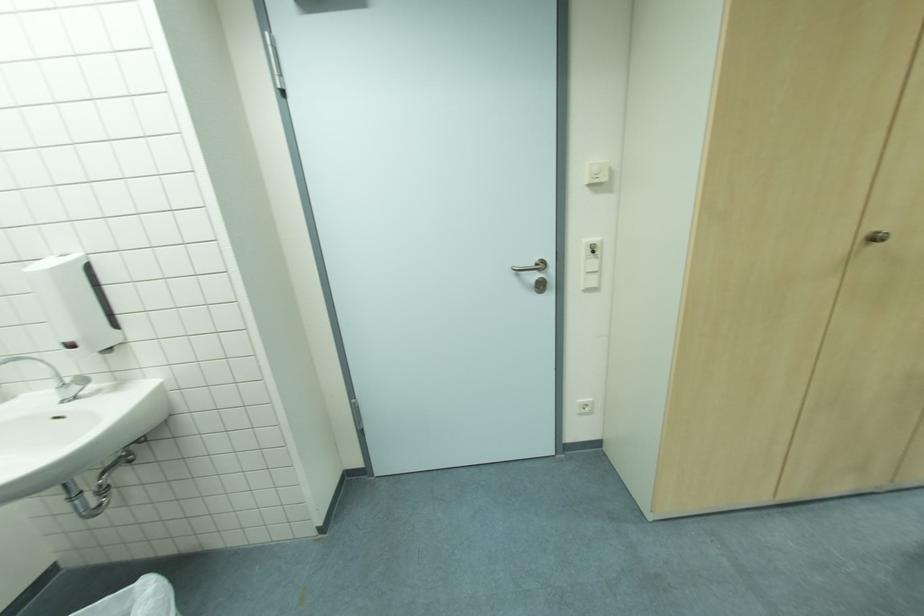
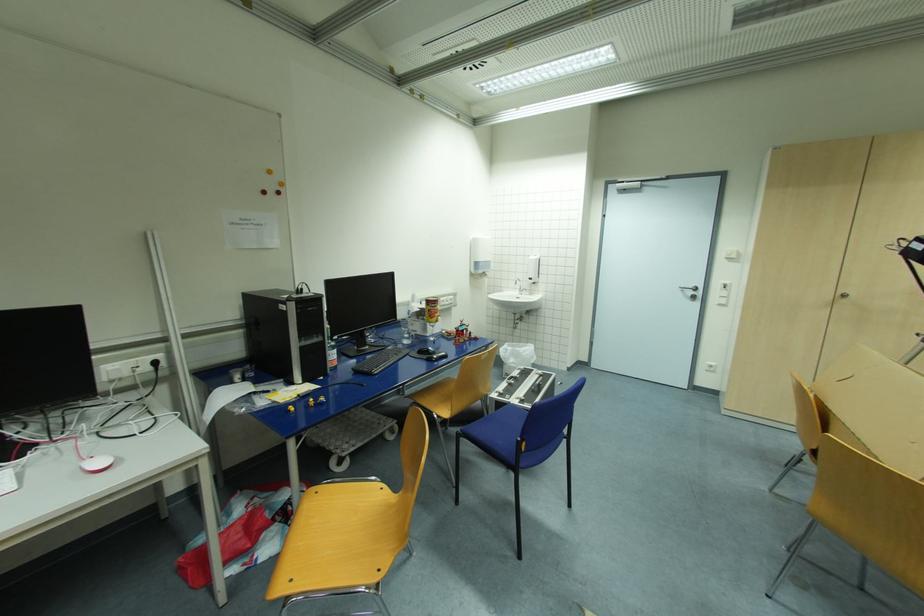
The point at (543, 265) is marked in the first image. Where is the corresponding point in the second image?

(699, 289)